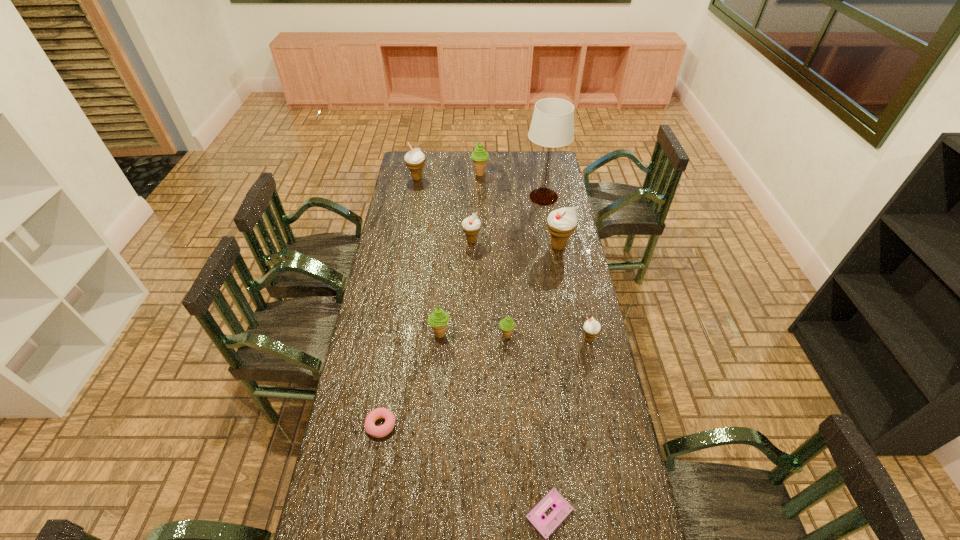
Point out which green icecream is positioned as the nearest to the tallest icecream. Please provide its 2D coordinates. Your answer should be formatted as a tuple, i.e. [(x, y)], where the tuple contains the x and y coordinates of a point satisfying the conditions above.

[(507, 324)]

Find the location of `green icecream that is the second closest to the biggest green icecream`. green icecream that is the second closest to the biggest green icecream is located at coordinates (507, 324).

Image resolution: width=960 pixels, height=540 pixels. I want to click on free space that satisfies the following two spatial constraints: 1. on the front side of the leftmost green icecream; 2. on the right side of the farthest white icecream, so click(391, 334).

The image size is (960, 540). What are the coordinates of `vacant area in the image that satisfies the following two spatial constraints: 1. on the front side of the third biggest white icecream; 2. on the left side of the smallest white icecream` in the screenshot? It's located at 469,339.

The image size is (960, 540). Find the location of `vacant region that satisfies the following two spatial constraints: 1. on the back side of the farthest green icecream; 2. on the right side of the second white icecream from left to right`. vacant region that satisfies the following two spatial constraints: 1. on the back side of the farthest green icecream; 2. on the right side of the second white icecream from left to right is located at coordinates (473, 174).